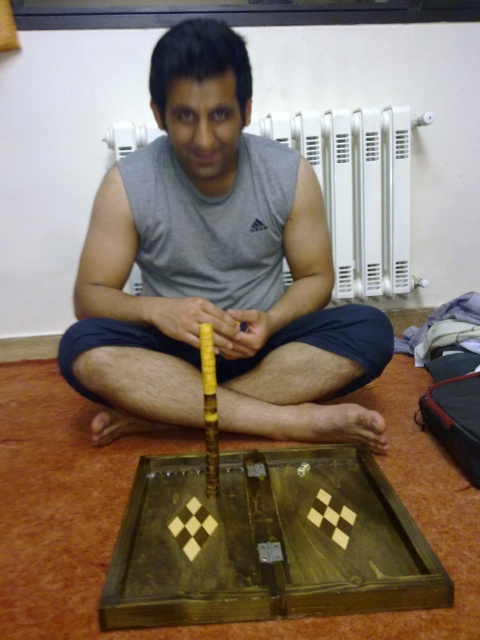
Can you confirm if gray matte tank top at center is positioned to the right of white plastic radiator at upper center?

In fact, gray matte tank top at center is to the left of white plastic radiator at upper center.

Who is positioned more to the right, gray matte tank top at center or white plastic radiator at upper center?

white plastic radiator at upper center is more to the right.

Where is `gray matte tank top at center`? gray matte tank top at center is located at coordinates (216, 269).

Locate an element on the screen. The width and height of the screenshot is (480, 640). gray matte tank top at center is located at coordinates (216, 269).